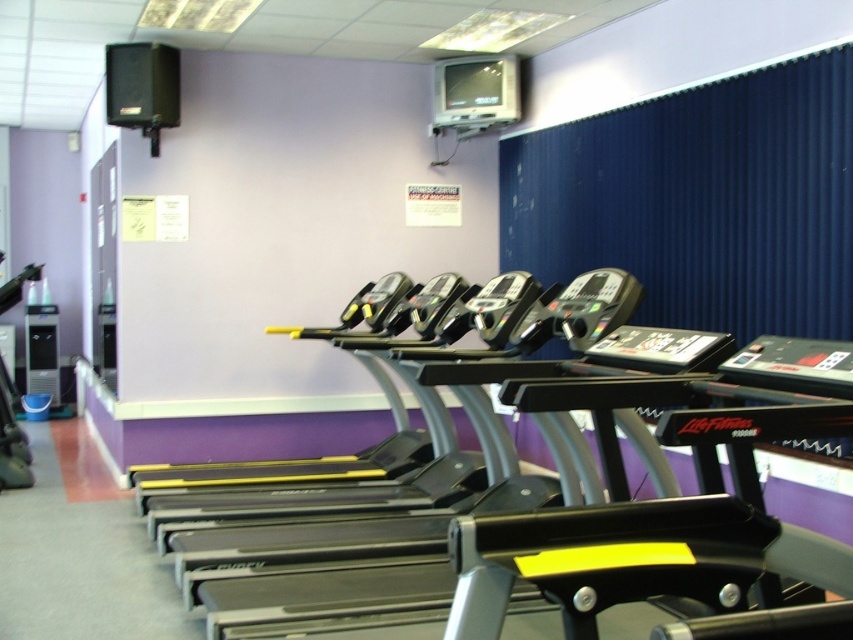
Is black plastic treadmills at center bigger than blue fabric curtain at upper right?

Yes.

What do you see at coordinates (537, 481) in the screenshot? Image resolution: width=853 pixels, height=640 pixels. I see `black plastic treadmills at center` at bounding box center [537, 481].

Which is behind, point (550, 387) or point (555, 186)?

The point (555, 186) is more distant.

Where is `black plastic treadmills at center`? black plastic treadmills at center is located at coordinates (537, 481).